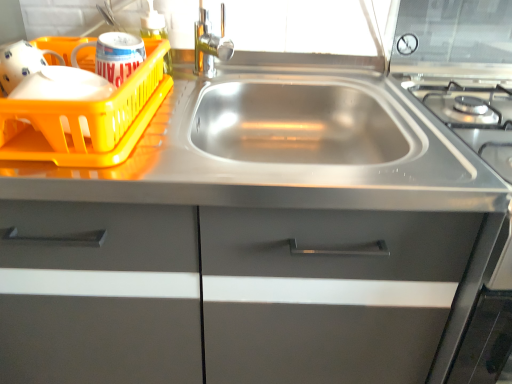
The width and height of the screenshot is (512, 384). Describe the element at coordinates (282, 151) in the screenshot. I see `stainless steel sink at center` at that location.

The height and width of the screenshot is (384, 512). Find the location of `yellow plastic basket at left`. yellow plastic basket at left is located at coordinates (87, 120).

This screenshot has height=384, width=512. What do you see at coordinates (225, 292) in the screenshot?
I see `stainless steel sink at center` at bounding box center [225, 292].

At what (x,y) coordinates should I click in order to perform the action: click on stainless steel sink at center. Please return your answer as a coordinate pair (x, y). The width and height of the screenshot is (512, 384). Looking at the image, I should click on (282, 151).

Is yellow plastic basket at left at the left side of stainless steel sink at center?

Correct, you'll find yellow plastic basket at left to the left of stainless steel sink at center.

From the image's perspective, is yellow plastic basket at left positioned above or below stainless steel sink at center?

From the image's perspective, yellow plastic basket at left appears above stainless steel sink at center.

Is yellow plastic basket at left aimed at stainless steel sink at center?

No, yellow plastic basket at left does not turn towards stainless steel sink at center.

How many degrees apart are the facing directions of yellow plastic basket at left and stainless steel sink at center?

There is a 1.09-degree angle between the facing directions of yellow plastic basket at left and stainless steel sink at center.

Is stainless steel sink at center positioned far away from stainless steel sink at center?

No, stainless steel sink at center is not far from stainless steel sink at center.

From the image's perspective, is stainless steel sink at center beneath stainless steel sink at center?

Correct, stainless steel sink at center appears lower than stainless steel sink at center in the image.

Between point (199, 370) and point (408, 110), which one is positioned behind?

Positioned behind is point (408, 110).

Is the surface of yellow plastic basket at left in direct contact with stainless steel sink at center?

No, yellow plastic basket at left is not beside stainless steel sink at center.

From the image's perspective, is yellow plastic basket at left on top of stainless steel sink at center?

Yes, from the image's perspective, yellow plastic basket at left is above stainless steel sink at center.

How many degrees apart are the facing directions of yellow plastic basket at left and stainless steel sink at center?

1.09 degrees.

Is yellow plastic basket at left thinner than stainless steel sink at center?

Correct, the width of yellow plastic basket at left is less than that of stainless steel sink at center.

Is stainless steel sink at center smaller than transparent plastic soap dispenser at upper center?

Actually, stainless steel sink at center might be larger than transparent plastic soap dispenser at upper center.

Based on the photo, is stainless steel sink at center thinner than transparent plastic soap dispenser at upper center?

No.

From a real-world perspective, who is located higher, stainless steel sink at center or transparent plastic soap dispenser at upper center?

In real-world perspective, transparent plastic soap dispenser at upper center is above.

Considering the relative sizes of stainless steel sink at center and transparent plastic soap dispenser at upper center in the image provided, is stainless steel sink at center shorter than transparent plastic soap dispenser at upper center?

Incorrect, the height of stainless steel sink at center does not fall short of that of transparent plastic soap dispenser at upper center.

Between transparent plastic soap dispenser at upper center and stainless steel sink at center, which one has larger width?

stainless steel sink at center.

Is transparent plastic soap dispenser at upper center smaller than stainless steel sink at center?

Yes, transparent plastic soap dispenser at upper center is smaller than stainless steel sink at center.

Relative to stainless steel sink at center, is transparent plastic soap dispenser at upper center in front or behind?

transparent plastic soap dispenser at upper center is positioned farther from the viewer than stainless steel sink at center.

Between stainless steel sink at center and transparent plastic soap dispenser at upper center, which one has less height?

Standing shorter between the two is stainless steel sink at center.

From a real-world perspective, is stainless steel sink at center on transparent plastic soap dispenser at upper center?

Actually, stainless steel sink at center is physically below transparent plastic soap dispenser at upper center in the real world.

Is stainless steel sink at center positioned with its back to transparent plastic soap dispenser at upper center?

No, transparent plastic soap dispenser at upper center is not at the back of stainless steel sink at center.

Are stainless steel sink at center and transparent plastic soap dispenser at upper center far apart?

No.

From the image's perspective, is stainless steel sink at center located above stainless steel sink at center?

Yes, from the image's perspective, stainless steel sink at center is above stainless steel sink at center.

Which object is wider, stainless steel sink at center or stainless steel sink at center?

With larger width is stainless steel sink at center.

Which is behind, point (262, 82) or point (82, 365)?

The point (262, 82) is farther from the camera.

Looking at this image, who is taller, stainless steel sink at center or stainless steel sink at center?

Standing taller between the two is stainless steel sink at center.

Identify the location of counter top that is below the yellow plastic basket at left (from the image's perspective). (282, 151).

Locate an element on the screen. The height and width of the screenshot is (384, 512). cabinetry below the stainless steel sink at center (from a real-world perspective) is located at coordinates (225, 292).

Which object lies further to the anchor point stainless steel sink at center, yellow plastic basket at left or stainless steel sink at center?

stainless steel sink at center is further to stainless steel sink at center.

Estimate the real-world distances between objects in this image. Which object is closer to stainless steel sink at center, stainless steel sink at center or yellow plastic basket at left?

Among the two, yellow plastic basket at left is located nearer to stainless steel sink at center.

Considering their positions, is yellow plastic basket at left positioned further to transparent plastic soap dispenser at upper center than stainless steel sink at center?

Based on the image, stainless steel sink at center appears to be further to transparent plastic soap dispenser at upper center.

Based on their spatial positions, is transparent plastic soap dispenser at upper center or stainless steel sink at center closer to stainless steel sink at center?

stainless steel sink at center lies closer to stainless steel sink at center than the other object.

Considering their positions, is stainless steel sink at center positioned closer to transparent plastic soap dispenser at upper center than stainless steel sink at center?

Among the two, stainless steel sink at center is located nearer to transparent plastic soap dispenser at upper center.

When comparing their distances from stainless steel sink at center, does stainless steel sink at center or transparent plastic soap dispenser at upper center seem closer?

Among the two, stainless steel sink at center is located nearer to stainless steel sink at center.

Based on their spatial positions, is transparent plastic soap dispenser at upper center or yellow plastic basket at left closer to stainless steel sink at center?

Based on the image, yellow plastic basket at left appears to be nearer to stainless steel sink at center.

Looking at the image, which one is located closer to yellow plastic basket at left, transparent plastic soap dispenser at upper center or stainless steel sink at center?

stainless steel sink at center lies closer to yellow plastic basket at left than the other object.

Locate an element on the screen. counter top between transparent plastic soap dispenser at upper center and stainless steel sink at center vertically is located at coordinates click(282, 151).

This screenshot has height=384, width=512. Identify the location of basket between transparent plastic soap dispenser at upper center and stainless steel sink at center from top to bottom. (87, 120).

Find the location of a particular element. The width and height of the screenshot is (512, 384). bottle located between yellow plastic basket at left and stainless steel sink at center in the left-right direction is located at coordinates (153, 24).

Image resolution: width=512 pixels, height=384 pixels. I want to click on counter top that lies between yellow plastic basket at left and stainless steel sink at center from top to bottom, so click(x=282, y=151).